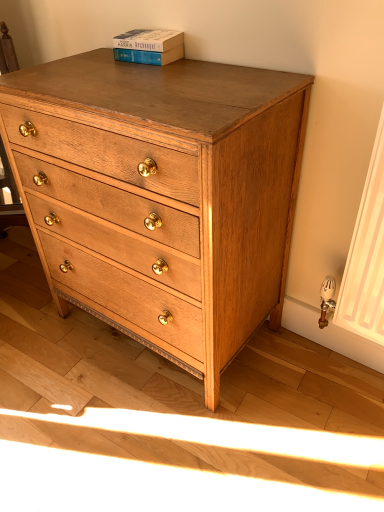
The height and width of the screenshot is (512, 384). In order to click on free location above natural wood chest of drawers at center (from a real-world perspective) in this screenshot , I will do pyautogui.click(x=142, y=78).